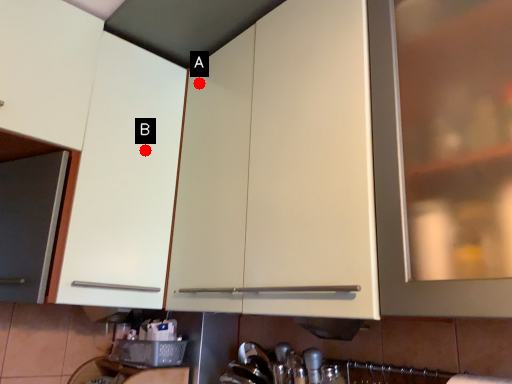
Question: Two points are circled on the image, labeled by A and B beside each circle. Which of the following is the farthest from the observer?

Choices:
 (A) A is further
 (B) B is further

Answer: (A)